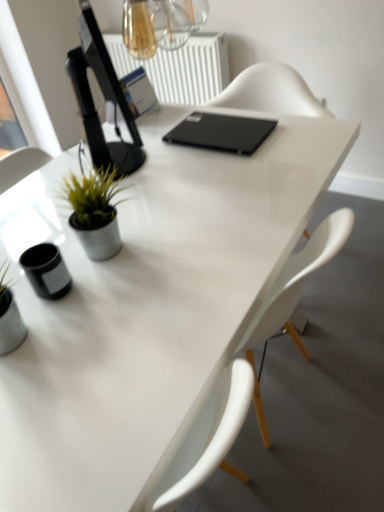
The image size is (384, 512). Identify the location of vacant space to the right of black matte laptop at center. (297, 133).